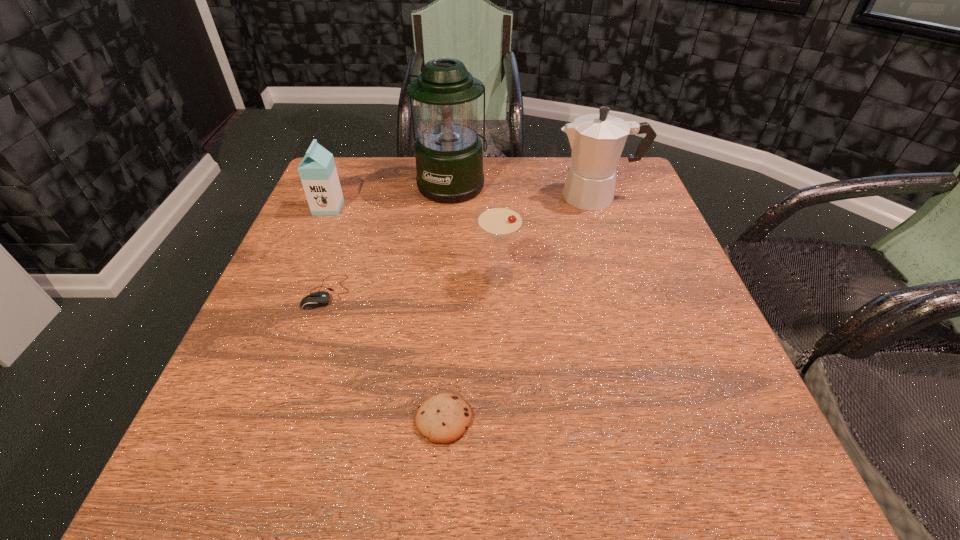
Locate an element on the screen. This screenshot has height=540, width=960. computer mouse located at the left edge is located at coordinates (314, 300).

Locate an element on the screen. The height and width of the screenshot is (540, 960). object that is at the right edge is located at coordinates (597, 140).

The image size is (960, 540). Find the location of `object at the far left corner`. object at the far left corner is located at coordinates tap(318, 173).

At what (x,y) coordinates should I click in order to perform the action: click on object present at the far right corner. Please return your answer as a coordinate pair (x, y). The width and height of the screenshot is (960, 540). Looking at the image, I should click on (597, 140).

The height and width of the screenshot is (540, 960). In order to click on blank space at the far edge of the desktop in this screenshot , I will do `click(542, 176)`.

At what (x,y) coordinates should I click in order to perform the action: click on free space at the near edge of the desktop. Please return your answer as a coordinate pair (x, y). Looking at the image, I should click on (362, 497).

Find the location of a particular element. vacant space at the left edge is located at coordinates (214, 397).

This screenshot has width=960, height=540. In order to click on free space at the right edge of the desktop in this screenshot , I will do `click(621, 233)`.

You are a GUI agent. You are given a task and a screenshot of the screen. Output one action in this format:
    pyautogui.click(x=<x>, y=<y>)
    Task: Click on the free location at the near left corner of the desktop
    This screenshot has width=960, height=540.
    Given the screenshot: What is the action you would take?
    pyautogui.click(x=233, y=446)

In the image, there is a desktop. Find the location of `vacant space at the far right corner`. vacant space at the far right corner is located at coordinates (633, 180).